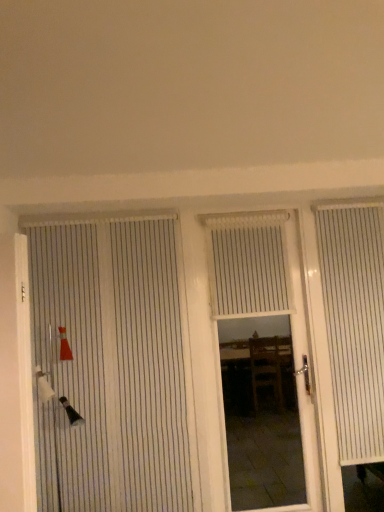
You are a GUI agent. You are given a task and a screenshot of the screen. Output one action in this format:
    pyautogui.click(x=<x>, y=<y>)
    Task: Click on the empty space that is ontop of white wood door at center, arranged as the 2th door when viewed from the left (from a real-world perspective)
    The height and width of the screenshot is (512, 384).
    Given the screenshot: What is the action you would take?
    pyautogui.click(x=248, y=214)